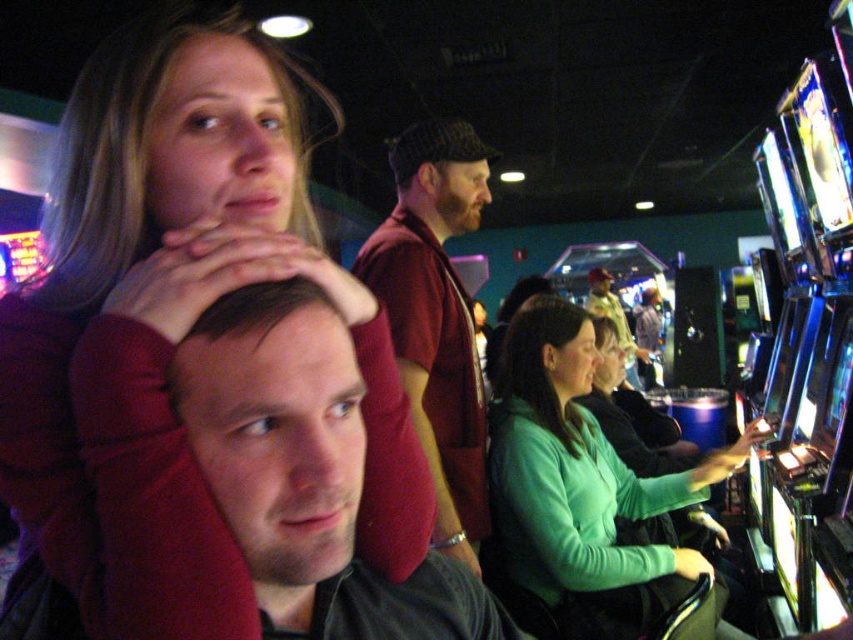
Question: Does smooth red shirt at upper left have a smaller size compared to maroon sweater at center?

Choices:
 (A) no
 (B) yes

Answer: (B)

Question: Which point is closer to the camera?

Choices:
 (A) (352, 356)
 (B) (170, 483)

Answer: (B)

Question: Can you confirm if smooth red shirt at upper left is positioned below green matte shirt at center?

Choices:
 (A) no
 (B) yes

Answer: (A)

Question: Which point is closer to the camera?

Choices:
 (A) matte black shirt at center
 (B) maroon sweater at center

Answer: (A)

Question: Which object appears closest to the camera in this image?

Choices:
 (A) matte black shirt at center
 (B) green matte shirt at center

Answer: (A)

Question: Is smooth red shirt at upper left wider than green matte shirt at center?

Choices:
 (A) yes
 (B) no

Answer: (B)